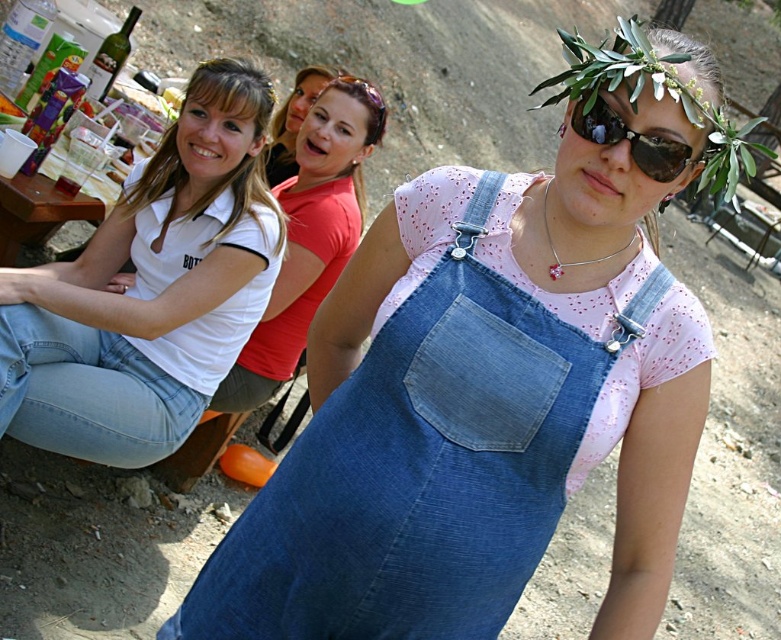
Is denim overall dress at center positioned in front of sunglasses at center?

Yes, it is.

Is point (573, 456) farther from viewer compared to point (598, 104)?

Yes, it is.

Find the location of a particular element. This screenshot has height=640, width=781. denim overall dress at center is located at coordinates (480, 403).

Between denim overall dress at center and white cotton shirt at upper left, which one has less height?

Standing shorter between the two is denim overall dress at center.

Which is more to the left, denim overall dress at center or white cotton shirt at upper left?

From the viewer's perspective, white cotton shirt at upper left appears more on the left side.

Measure the distance between denim overall dress at center and camera.

denim overall dress at center is 1.41 meters from camera.

You are a GUI agent. You are given a task and a screenshot of the screen. Output one action in this format:
    pyautogui.click(x=<x>, y=<y>)
    Task: Click on the denim overall dress at center
    Image resolution: width=781 pixels, height=640 pixels.
    Given the screenshot: What is the action you would take?
    pyautogui.click(x=480, y=403)

Who is taller, denim pocket at center or sunglasses at center?

Standing taller between the two is denim pocket at center.

Does point (487, 380) come farther from viewer compared to point (594, 125)?

Yes, point (487, 380) is farther from viewer.

I want to click on denim pocket at center, so click(480, 364).